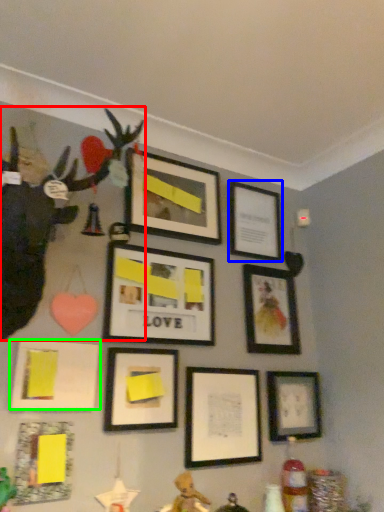
Question: Which is farther away from toy (highlighted by a red box)? picture frame (highlighted by a blue box) or picture frame (highlighted by a green box)?

Choices:
 (A) picture frame
 (B) picture frame

Answer: (A)